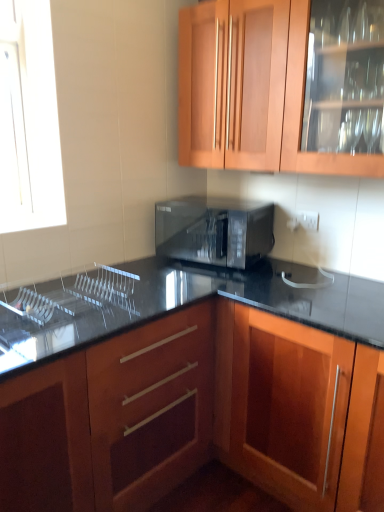
Question: From the image's perspective, is clear glass sink at lower left above or below black glossy microwave at center?

Choices:
 (A) below
 (B) above

Answer: (A)

Question: From a real-world perspective, is clear glass sink at lower left above or below black glossy microwave at center?

Choices:
 (A) above
 (B) below

Answer: (B)

Question: Which object is the closest to the wooden cabinet at upper center, the 1th cabinetry positioned from the top?

Choices:
 (A) black glossy microwave at center
 (B) wooden cabinet at center, which is counted as the second cabinetry, starting from the top
 (C) clear glass sink at lower left

Answer: (A)

Question: Which object is the farthest from the clear glass sink at lower left?

Choices:
 (A) wooden cabinet at upper center, the second cabinetry in the bottom-to-top sequence
 (B) black glossy microwave at center
 (C) wooden cabinet at center, which is counted as the second cabinetry, starting from the top

Answer: (A)